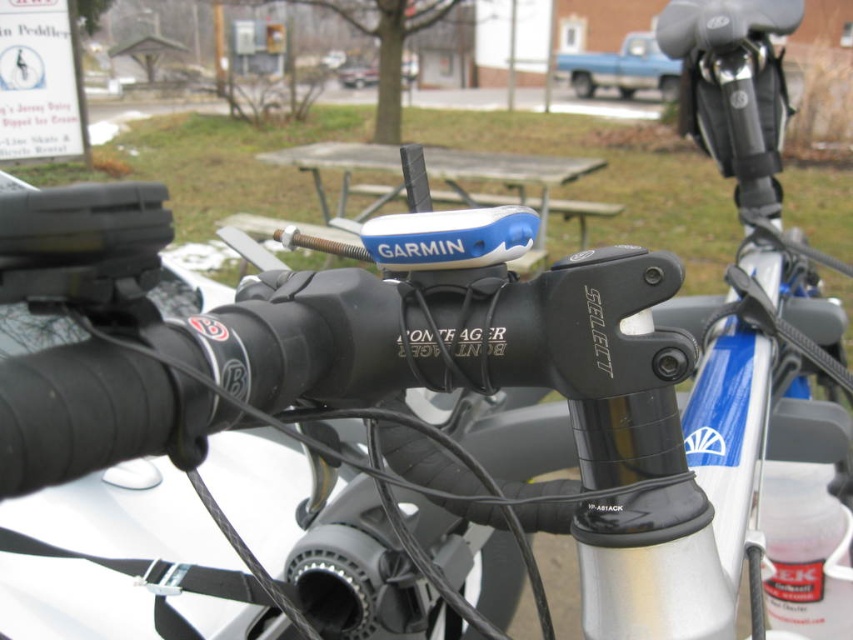
The width and height of the screenshot is (853, 640). Describe the element at coordinates (515, 182) in the screenshot. I see `blue plastic picnic table at center` at that location.

Is blue plastic picnic table at center positioned behind blue matte truck at upper center?

No, it is not.

Is point (495, 173) less distant than point (645, 65)?

Yes, point (495, 173) is closer to viewer.

Locate an element on the screen. This screenshot has width=853, height=640. blue plastic picnic table at center is located at coordinates (515, 182).